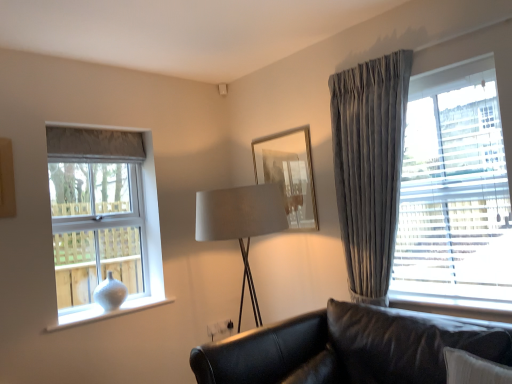
How much space does velvet gray curtain at right, positioned as the second window in back-to-front order, occupy vertically?

It is 5.04 feet.

The image size is (512, 384). What do you see at coordinates (104, 219) in the screenshot?
I see `white matte vase at left, the second window positioned from the right` at bounding box center [104, 219].

Locate an element on the screen. The width and height of the screenshot is (512, 384). white matte vase at left, the second window positioned from the right is located at coordinates tap(104, 219).

Describe the element at coordinates (369, 167) in the screenshot. I see `satin grey curtain at right` at that location.

What are the coordinates of `satin beige lampshade at center` in the screenshot? It's located at (241, 222).

This screenshot has height=384, width=512. Identify the location of velvet gray curtain at right, placed as the first window when sorted from front to back. (454, 192).

Are white glossy vase at lower left and satin beige lampshade at center making contact?

No, white glossy vase at lower left is not next to satin beige lampshade at center.

From a real-world perspective, is white glossy vase at lower left on top of satin beige lampshade at center?

No, from a real-world perspective, white glossy vase at lower left is not on top of satin beige lampshade at center.

From the picture: Considering the sizes of white glossy vase at lower left and satin beige lampshade at center in the image, is white glossy vase at lower left bigger or smaller than satin beige lampshade at center?

Clearly, white glossy vase at lower left is smaller in size than satin beige lampshade at center.

Is gold-framed mirror at center not inside white matte vase at left, the first window from the back?

That's correct, gold-framed mirror at center is outside of white matte vase at left, the first window from the back.

How far apart are gold-framed mirror at center and white matte vase at left, the second window positioned from the right?

The distance of gold-framed mirror at center from white matte vase at left, the second window positioned from the right, is 1.13 meters.

Based on the photo, is gold-framed mirror at center smaller than white matte vase at left, the first window from the back?

Indeed, gold-framed mirror at center has a smaller size compared to white matte vase at left, the first window from the back.

Is gold-framed mirror at center positioned in front of white matte vase at left, which is the second window in front-to-back order?

That is False.

Considering the relative sizes of white glossy vase at lower left and white matte vase at left, which is the second window in front-to-back order, in the image provided, is white glossy vase at lower left smaller than white matte vase at left, which is the second window in front-to-back order,?

Indeed, white glossy vase at lower left has a smaller size compared to white matte vase at left, which is the second window in front-to-back order.

Is white glossy vase at lower left taller or shorter than white matte vase at left, positioned as the 1th window in left-to-right order?

white glossy vase at lower left is shorter than white matte vase at left, positioned as the 1th window in left-to-right order.

Is white glossy vase at lower left positioned behind white matte vase at left, positioned as the 1th window in left-to-right order?

No, white glossy vase at lower left is in front of white matte vase at left, positioned as the 1th window in left-to-right order.

From a real-world perspective, is gold-framed mirror at center physically located above or below velvet gray curtain at right, placed as the first window when sorted from front to back?

From a real-world perspective, gold-framed mirror at center is physically above velvet gray curtain at right, placed as the first window when sorted from front to back.

Does gold-framed mirror at center appear on the left side of velvet gray curtain at right, positioned as the second window in back-to-front order?

Yes.

Considering the positions of point (292, 156) and point (410, 128), is point (292, 156) closer or farther from the camera than point (410, 128)?

Clearly, point (292, 156) is more distant from the camera than point (410, 128).

Could you tell me if gold-framed mirror at center is turned towards velvet gray curtain at right, which is the 1th window in right-to-left order?

No, gold-framed mirror at center is not turned towards velvet gray curtain at right, which is the 1th window in right-to-left order.

Relative to white glossy vase at lower left, is white matte vase at left, which is the second window in front-to-back order, in front or behind?

In the image, white matte vase at left, which is the second window in front-to-back order, appears behind white glossy vase at lower left.

Can you confirm if white matte vase at left, the second window positioned from the right, is smaller than white glossy vase at lower left?

Incorrect, white matte vase at left, the second window positioned from the right, is not smaller in size than white glossy vase at lower left.

Can you confirm if white matte vase at left, the first window from the back, is wider than white glossy vase at lower left?

In fact, white matte vase at left, the first window from the back, might be narrower than white glossy vase at lower left.

Is white matte vase at left, the first window from the back, positioned beyond the bounds of satin grey curtain at right?

Yes, white matte vase at left, the first window from the back, is located beyond the bounds of satin grey curtain at right.

Considering the points (105, 190) and (339, 124), which point is behind, point (105, 190) or point (339, 124)?

The point (105, 190) is behind.

From a real-world perspective, relative to satin grey curtain at right, is white matte vase at left, the second window positioned from the right, vertically above or below?

Clearly, from a real-world perspective, white matte vase at left, the second window positioned from the right, is below satin grey curtain at right.

How distant is white matte vase at left, positioned as the 1th window in left-to-right order, from satin grey curtain at right?

1.69 meters.

Is white matte vase at left, the first window from the back, bigger or smaller than black leather couch at lower right?

white matte vase at left, the first window from the back, is smaller than black leather couch at lower right.

Between white matte vase at left, the second window positioned from the right, and black leather couch at lower right, which one has more height?

white matte vase at left, the second window positioned from the right.

From a real-world perspective, is white matte vase at left, which is the second window in front-to-back order, under black leather couch at lower right?

No.

Locate an element on the screen. The height and width of the screenshot is (384, 512). table lamp on the right of white glossy vase at lower left is located at coordinates click(x=241, y=222).

You are a GUI agent. You are given a task and a screenshot of the screen. Output one action in this format:
    pyautogui.click(x=<x>, y=<y>)
    Task: Click on the picture frame above the white matte vase at left, which is the second window in front-to-back order (from a real-world perspective)
    Image resolution: width=512 pixels, height=384 pixels.
    Given the screenshot: What is the action you would take?
    pyautogui.click(x=289, y=173)

In the scene shown: Considering their positions, is white matte vase at left, the first window from the back, positioned further to satin beige lampshade at center than satin grey curtain at right?

Among the two, white matte vase at left, the first window from the back, is located further to satin beige lampshade at center.

Looking at the image, which one is located closer to black leather couch at lower right, velvet gray curtain at right, the 2th window from the left, or white glossy vase at lower left?

The object closer to black leather couch at lower right is velvet gray curtain at right, the 2th window from the left.

Looking at the image, which one is located closer to white matte vase at left, positioned as the 1th window in left-to-right order, velvet gray curtain at right, positioned as the second window in back-to-front order, or gold-framed mirror at center?

The object closer to white matte vase at left, positioned as the 1th window in left-to-right order, is gold-framed mirror at center.

In the scene shown: Estimate the real-world distances between objects in this image. Which object is further from white glossy vase at lower left, black leather couch at lower right or white matte vase at left, the first window from the back?

The object further to white glossy vase at lower left is black leather couch at lower right.

From the image, which object appears to be nearer to satin grey curtain at right, velvet gray curtain at right, positioned as the second window in back-to-front order, or gold-framed mirror at center?

velvet gray curtain at right, positioned as the second window in back-to-front order, is positioned closer to the anchor satin grey curtain at right.

From the image, which object appears to be nearer to white glossy vase at lower left, velvet gray curtain at right, the 2th window from the left, or black leather couch at lower right?

The object closer to white glossy vase at lower left is black leather couch at lower right.

Estimate the real-world distances between objects in this image. Which object is closer to white matte vase at left, positioned as the 1th window in left-to-right order, satin beige lampshade at center or gold-framed mirror at center?

The object closer to white matte vase at left, positioned as the 1th window in left-to-right order, is satin beige lampshade at center.

Which object lies nearer to the anchor point satin beige lampshade at center, gold-framed mirror at center or white matte vase at left, the second window positioned from the right?

Based on the image, gold-framed mirror at center appears to be nearer to satin beige lampshade at center.

This screenshot has height=384, width=512. Find the location of `table lamp located between black leather couch at lower right and white glossy vase at lower left in the depth direction`. table lamp located between black leather couch at lower right and white glossy vase at lower left in the depth direction is located at coordinates (241, 222).

The width and height of the screenshot is (512, 384). In order to click on table lamp between white matte vase at left, the first window from the back, and satin grey curtain at right from left to right in this screenshot , I will do `click(241, 222)`.

I want to click on studio couch located between white glossy vase at lower left and satin grey curtain at right in the left-right direction, so click(350, 348).

Image resolution: width=512 pixels, height=384 pixels. I want to click on table lamp between white glossy vase at lower left and gold-framed mirror at center in the horizontal direction, so pyautogui.click(x=241, y=222).